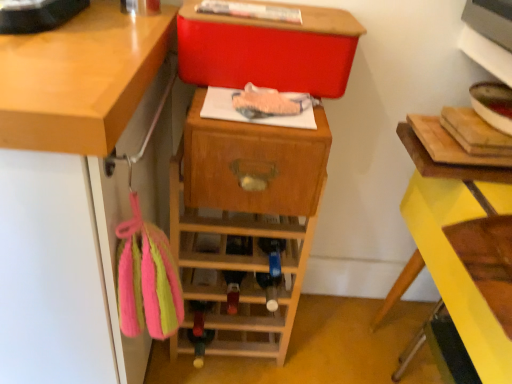
In order to click on free location above wooden drawer at center (from a real-world perspective) in this screenshot , I will do `click(259, 104)`.